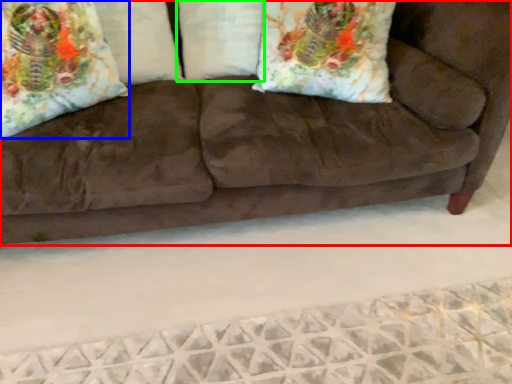
Question: Which is nearer to the studio couch (highlighted by a red box)? throw pillow (highlighted by a blue box) or pillow (highlighted by a green box).

Choices:
 (A) throw pillow
 (B) pillow

Answer: (B)